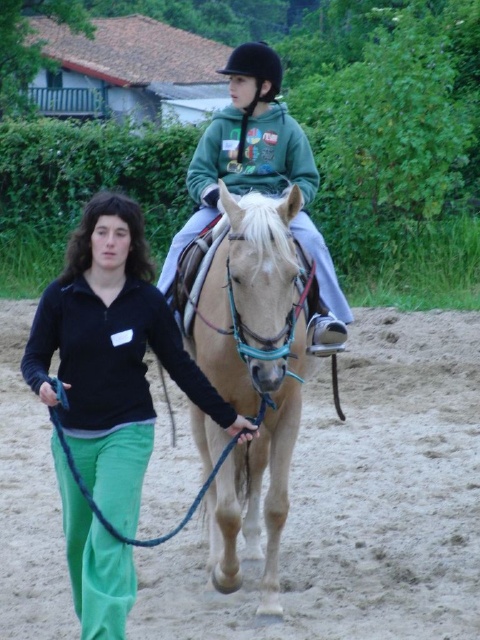
You are standing in the outdoor scene with the horse and two people. There are two points marked in the image. Which point is closer to you, point (x=45, y=298) or point (x=265, y=68)?

Point (x=45, y=298) is closer to the viewer than point (x=265, y=68).